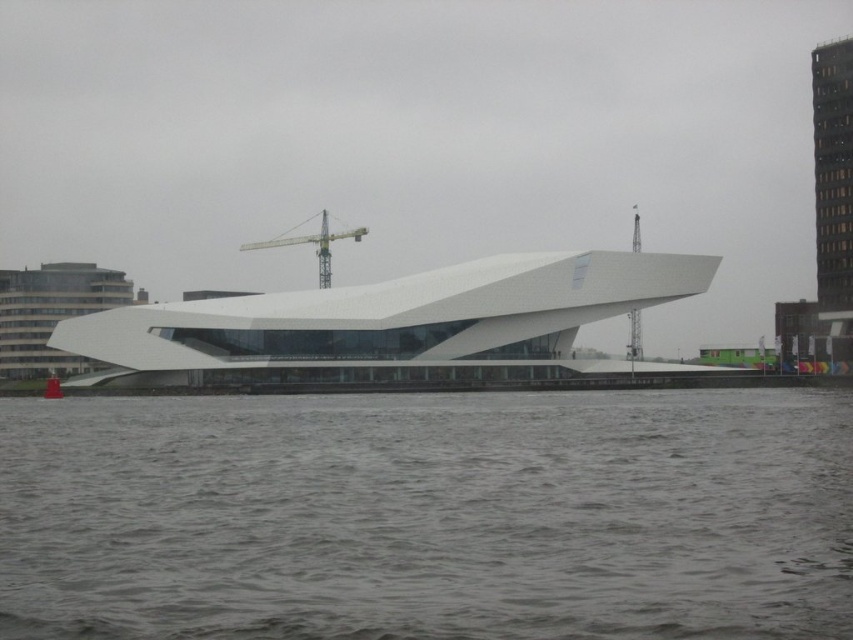
Does gray water at lower center have a lesser width compared to yellow metallic crane at center?

No, gray water at lower center is not thinner than yellow metallic crane at center.

Looking at this image, between gray water at lower center and yellow metallic crane at center, which one has more height?

Standing taller between the two is yellow metallic crane at center.

Is point (688, 524) in front of point (328, 275)?

Yes.

Image resolution: width=853 pixels, height=640 pixels. Identify the location of gray water at lower center. (428, 516).